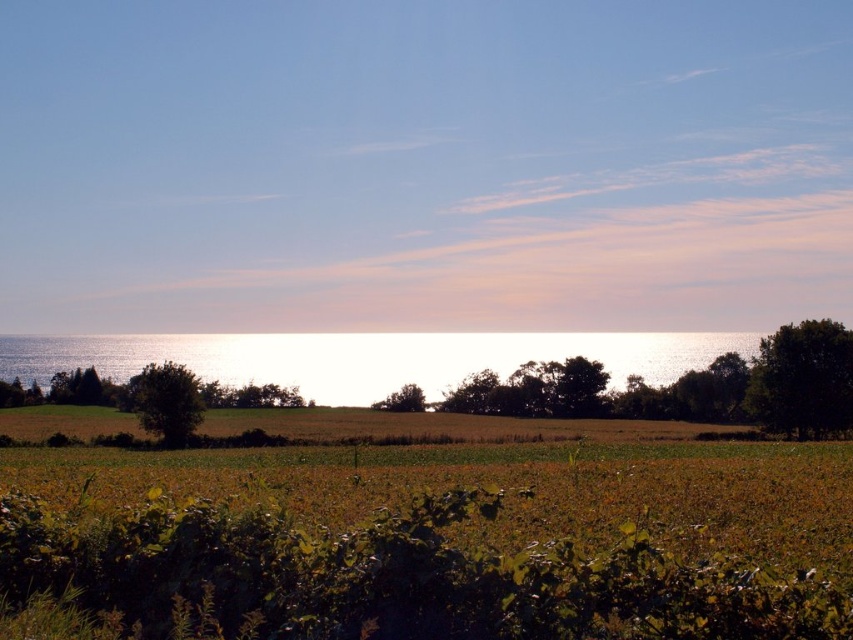
Identify the location of glistening silver water at center. (364, 356).

Describe the element at coordinates (364, 356) in the screenshot. I see `glistening silver water at center` at that location.

At what (x,y) coordinates should I click in order to perform the action: click on glistening silver water at center. Please return your answer as a coordinate pair (x, y). This screenshot has width=853, height=640. Looking at the image, I should click on (364, 356).

Does green leafy tree at right have a larger size compared to green matte tree at center?

Yes, green leafy tree at right is bigger than green matte tree at center.

Is point (827, 401) closer to viewer compared to point (395, 392)?

That is True.

Is point (755, 364) positioned before point (408, 406)?

Yes, point (755, 364) is in front of point (408, 406).

You are a GUI agent. You are given a task and a screenshot of the screen. Output one action in this format:
    pyautogui.click(x=<x>, y=<y>)
    Task: Click on the green leafy tree at right
    This screenshot has height=640, width=853.
    Given the screenshot: What is the action you would take?
    pyautogui.click(x=802, y=380)

Is glistening silver water at center smaller than green matte tree at center?

Actually, glistening silver water at center might be larger than green matte tree at center.

Consider the image. Can you confirm if glistening silver water at center is taller than green matte tree at center?

Correct, glistening silver water at center is much taller as green matte tree at center.

Does point (440, 362) lie in front of point (404, 404)?

No, (440, 362) is behind (404, 404).

Locate an element on the screen. This screenshot has height=640, width=853. glistening silver water at center is located at coordinates (364, 356).